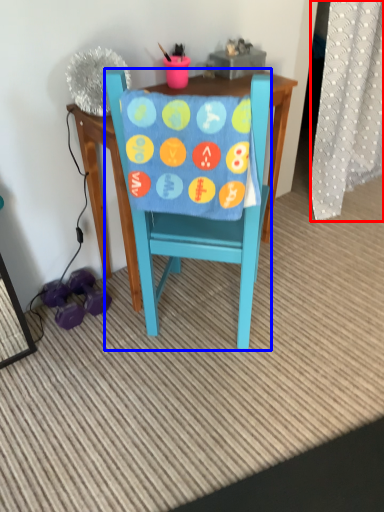
Question: Among these objects, which one is farthest to the camera, curtain (highlighted by a red box) or chair (highlighted by a blue box)?

Choices:
 (A) curtain
 (B) chair

Answer: (A)